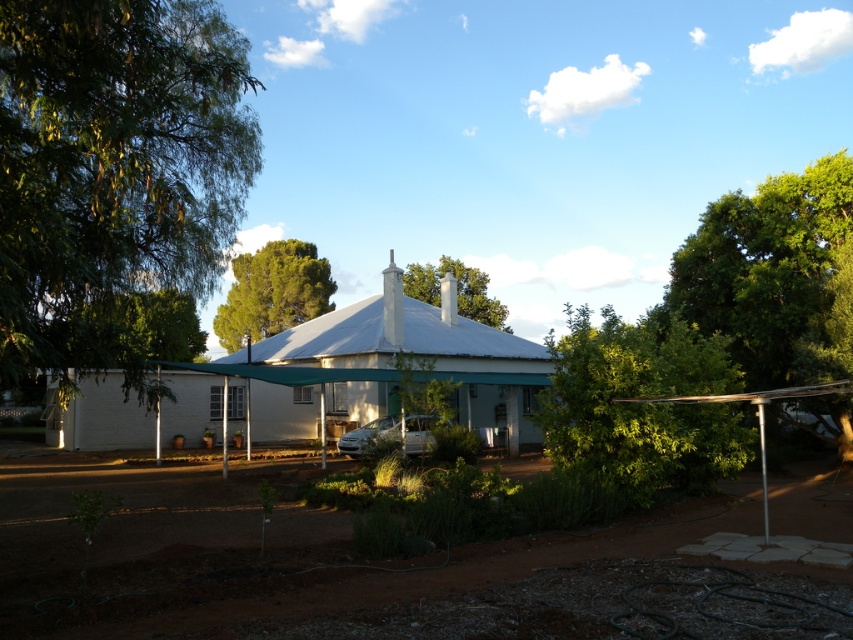
Does point (216, 376) lie behind point (263, 250)?

No, (216, 376) is closer to viewer.

Which is more to the right, white fabric tent at center or green leafy tree at upper center?

white fabric tent at center is more to the right.

I want to click on white fabric tent at center, so click(328, 378).

Does white fabric tent at center appear on the right side of green leafy bush at center?

Incorrect, white fabric tent at center is not on the right side of green leafy bush at center.

Who is higher up, white fabric tent at center or green leafy bush at center?

Positioned higher is white fabric tent at center.

The width and height of the screenshot is (853, 640). I want to click on white fabric tent at center, so click(x=328, y=378).

Which is more to the left, green leafy tree at left or white fabric tent at center?

From the viewer's perspective, white fabric tent at center appears more on the left side.

What do you see at coordinates (113, 168) in the screenshot? The width and height of the screenshot is (853, 640). I see `green leafy tree at left` at bounding box center [113, 168].

Does point (155, 35) come in front of point (103, 396)?

That is True.

I want to click on green leafy tree at left, so click(113, 168).